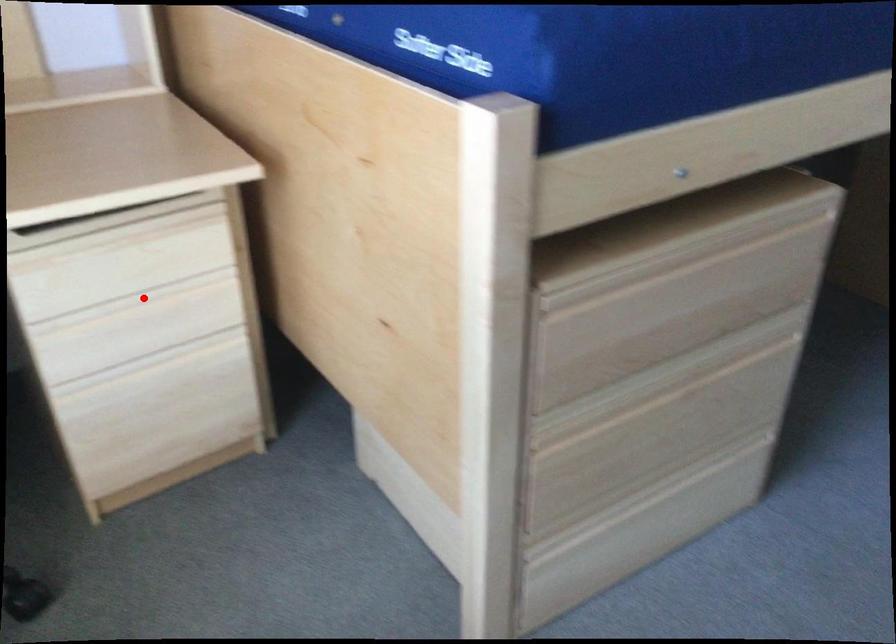
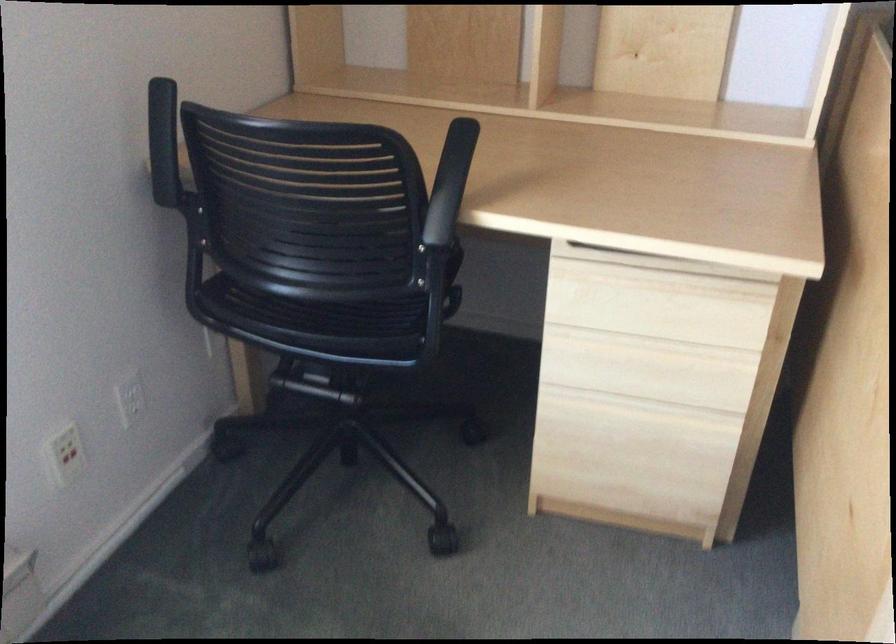
Locate, in the second image, the point that corresponds to the highlighted location in the first image.

(652, 345)